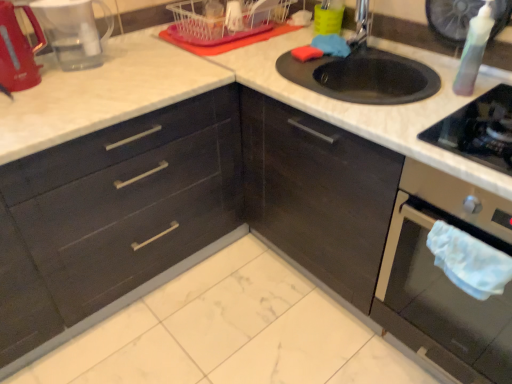
Identify the location of vacant area on the back side of metallic silver faucet at upper right. The image size is (512, 384). 354,33.